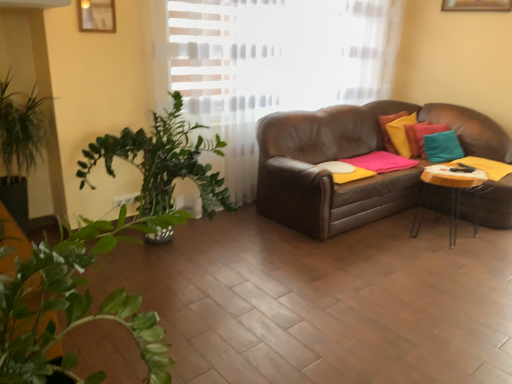
Question: From the image's perspective, is yellow matte table at right over teal fabric pillow at upper right?

Choices:
 (A) yes
 (B) no

Answer: (B)

Question: Is yellow matte table at right located outside teal fabric pillow at upper right?

Choices:
 (A) yes
 (B) no

Answer: (A)

Question: From a real-world perspective, is yellow matte table at right physically below teal fabric pillow at upper right?

Choices:
 (A) yes
 (B) no

Answer: (A)

Question: Considering the relative positions of yellow matte table at right and teal fabric pillow at upper right in the image provided, is yellow matte table at right to the left of teal fabric pillow at upper right from the viewer's perspective?

Choices:
 (A) yes
 (B) no

Answer: (A)

Question: Considering the relative sizes of yellow matte table at right and teal fabric pillow at upper right in the image provided, is yellow matte table at right shorter than teal fabric pillow at upper right?

Choices:
 (A) no
 (B) yes

Answer: (A)

Question: Considering the relative positions of wooden picture frame at upper left and yellow matte table at right in the image provided, is wooden picture frame at upper left to the left or to the right of yellow matte table at right?

Choices:
 (A) right
 (B) left

Answer: (B)

Question: From a real-world perspective, is wooden picture frame at upper left above or below yellow matte table at right?

Choices:
 (A) below
 (B) above

Answer: (B)

Question: From the image's perspective, relative to yellow matte table at right, is wooden picture frame at upper left above or below?

Choices:
 (A) below
 (B) above

Answer: (B)

Question: Considering the positions of wooden picture frame at upper left and yellow matte table at right in the image, is wooden picture frame at upper left bigger or smaller than yellow matte table at right?

Choices:
 (A) small
 (B) big

Answer: (A)

Question: In terms of width, does yellow matte table at right look wider or thinner when compared to wooden picture frame at upper left?

Choices:
 (A) thin
 (B) wide

Answer: (B)

Question: Is point (435, 178) positioned closer to the camera than point (95, 29)?

Choices:
 (A) closer
 (B) farther

Answer: (B)

Question: Based on their positions, is yellow matte table at right located to the left or right of wooden picture frame at upper left?

Choices:
 (A) left
 (B) right

Answer: (B)

Question: Considering the positions of yellow matte table at right and wooden picture frame at upper left in the image, is yellow matte table at right bigger or smaller than wooden picture frame at upper left?

Choices:
 (A) big
 (B) small

Answer: (A)

Question: Considering the positions of wooden picture frame at upper left and teal fabric pillow at upper right in the image, is wooden picture frame at upper left wider or thinner than teal fabric pillow at upper right?

Choices:
 (A) thin
 (B) wide

Answer: (A)

Question: In terms of height, does wooden picture frame at upper left look taller or shorter compared to teal fabric pillow at upper right?

Choices:
 (A) short
 (B) tall

Answer: (A)